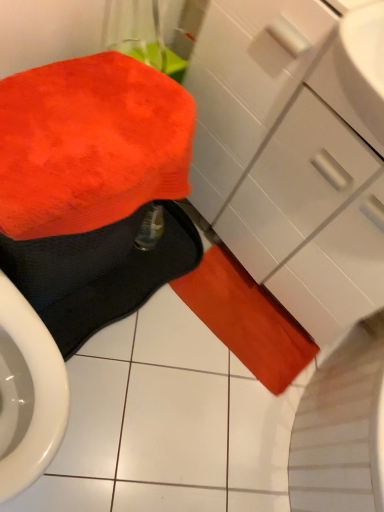
Question: Should I look upward or downward to see matte white drawer at center-right?

Choices:
 (A) down
 (B) up

Answer: (B)

Question: From a real-world perspective, is fluffy orange towel at lower left, which is the first bath towel in front-to-back order, on top of orange suede bath towel at lower center, which is the 3th bath towel from front to back?

Choices:
 (A) yes
 (B) no

Answer: (A)

Question: From the image's perspective, is fluffy orange towel at lower left, which is the first bath towel in front-to-back order, beneath orange suede bath towel at lower center, which is the 3th bath towel from front to back?

Choices:
 (A) no
 (B) yes

Answer: (A)

Question: Is fluffy orange towel at lower left, which is the first bath towel in front-to-back order, oriented towards orange suede bath towel at lower center, the first bath towel in the back-to-front sequence?

Choices:
 (A) no
 (B) yes

Answer: (A)

Question: Can you confirm if fluffy orange towel at lower left, which is the first bath towel in front-to-back order, is positioned to the left of orange suede bath towel at lower center, which is the 3th bath towel from front to back?

Choices:
 (A) no
 (B) yes

Answer: (B)

Question: Is fluffy orange towel at lower left, which is the first bath towel in front-to-back order, taller than orange suede bath towel at lower center, the first bath towel in the back-to-front sequence?

Choices:
 (A) yes
 (B) no

Answer: (A)

Question: Is the depth of fluffy orange towel at lower left, which is counted as the 3th bath towel, starting from the back, greater than that of orange suede bath towel at lower center, the first bath towel in the back-to-front sequence?

Choices:
 (A) yes
 (B) no

Answer: (B)

Question: Does matte white drawer at center-right lie behind orange fuzzy bath towel at lower center, the 2th bath towel when ordered from back to front?

Choices:
 (A) no
 (B) yes

Answer: (A)

Question: Is matte white drawer at center-right in front of orange fuzzy bath towel at lower center, the 2th bath towel when ordered from back to front?

Choices:
 (A) no
 (B) yes

Answer: (B)

Question: Is matte white drawer at center-right outside orange fuzzy bath towel at lower center, the 2th bath towel when ordered from back to front?

Choices:
 (A) no
 (B) yes

Answer: (B)

Question: Does matte white drawer at center-right touch orange fuzzy bath towel at lower center, which is counted as the second bath towel, starting from the front?

Choices:
 (A) no
 (B) yes

Answer: (A)

Question: Is matte white drawer at center-right not close to orange fuzzy bath towel at lower center, the 2th bath towel when ordered from back to front?

Choices:
 (A) yes
 (B) no

Answer: (B)

Question: From the image's perspective, does matte white drawer at center-right appear higher than orange fuzzy bath towel at lower center, which is counted as the second bath towel, starting from the front?

Choices:
 (A) no
 (B) yes

Answer: (B)

Question: From the image's perspective, does fluffy orange towel at lower left, which is the first bath towel in front-to-back order, appear lower than matte white drawer at center-right?

Choices:
 (A) no
 (B) yes

Answer: (B)